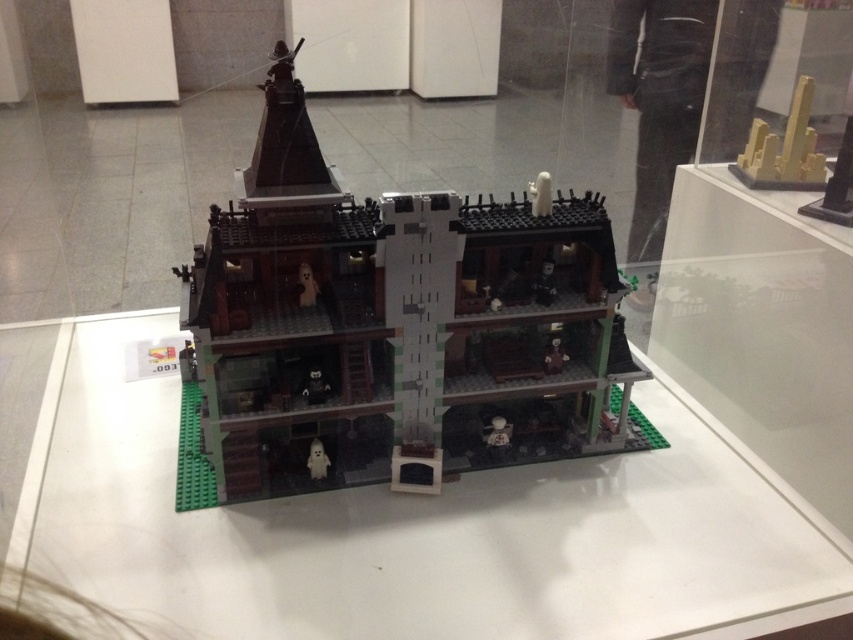
You are a visitor at the Lego exhibition and want to take a photo of the haunted house. The yellow matte cityscape at upper right and the translucent white ghost at center are both in the background. Which object should you focus on to ensure the ghost is in sharp focus?

You should focus on the translucent white ghost at center because it is closer to you than the yellow matte cityscape at upper right, so focusing on it will keep the ghost in sharp focus while the cityscape may appear slightly blurred.